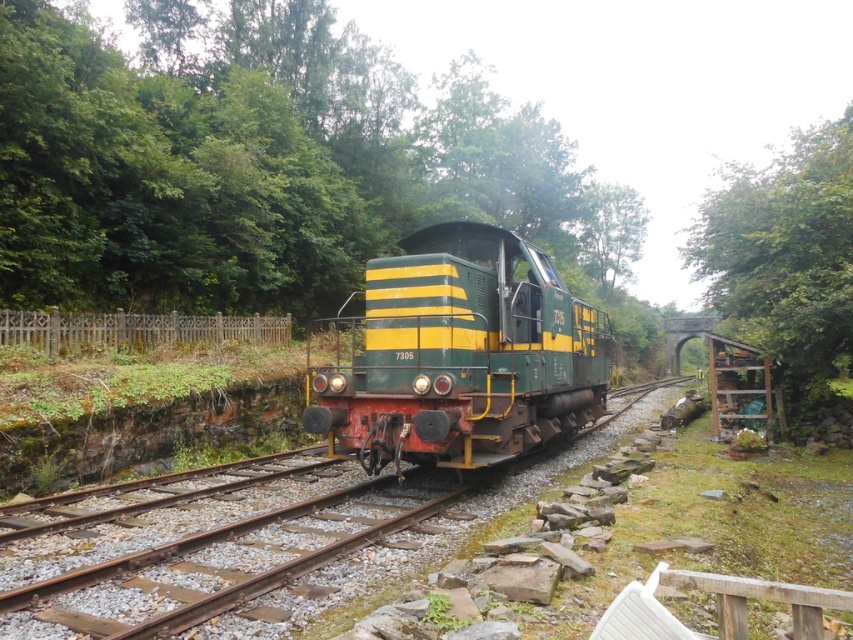
Is green/yellow locomotive at center smaller than green leafy tree at right?

Yes, green/yellow locomotive at center is smaller than green leafy tree at right.

From the picture: Between green/yellow locomotive at center and green leafy tree at right, which one is positioned higher?

Positioned higher is green leafy tree at right.

Is point (280, 563) positioned after point (810, 230)?

No, it is not.

In order to click on green/yellow locomotive at center in this screenshot , I will do `click(248, 544)`.

Which is below, green/yellow striped locomotive at center or green leafy tree at right?

green/yellow striped locomotive at center

Measure the distance between green/yellow striped locomotive at center and camera.

The distance of green/yellow striped locomotive at center from camera is 26.47 feet.

What do you see at coordinates (462, 355) in the screenshot? Image resolution: width=853 pixels, height=640 pixels. I see `green/yellow striped locomotive at center` at bounding box center [462, 355].

Locate an element on the screen. green/yellow striped locomotive at center is located at coordinates (462, 355).

Does green/yellow locomotive at center come in front of green leafy tree at upper center?

Yes, green/yellow locomotive at center is closer to the viewer.

The height and width of the screenshot is (640, 853). Describe the element at coordinates (248, 544) in the screenshot. I see `green/yellow locomotive at center` at that location.

Is point (283, 611) positioned behind point (585, 252)?

No, (283, 611) is in front of (585, 252).

Where is `green/yellow locomotive at center`? The width and height of the screenshot is (853, 640). green/yellow locomotive at center is located at coordinates (248, 544).